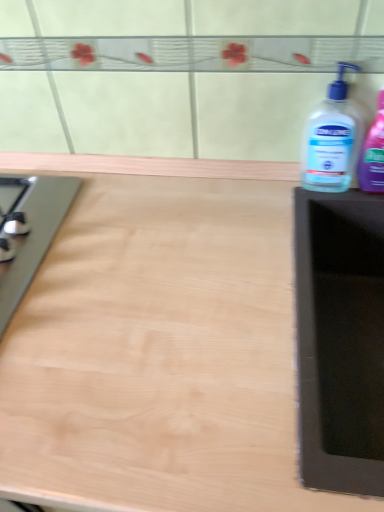
Question: Considering the positions of point (336, 184) and point (289, 423), is point (336, 184) closer or farther from the camera than point (289, 423)?

Choices:
 (A) closer
 (B) farther

Answer: (B)

Question: Relative to light wood countertop at center, is transparent plastic bottle at right, the first bottle when ordered from left to right, in front or behind?

Choices:
 (A) behind
 (B) front

Answer: (A)

Question: Which of these objects is positioned farthest from the transparent plastic bottle at right, which appears as the 2th bottle when viewed from the right?

Choices:
 (A) transparent plastic bottle at right, arranged as the 2th bottle when viewed from the left
 (B) light wood countertop at center

Answer: (B)

Question: Which object is the closest to the light wood countertop at center?

Choices:
 (A) transparent plastic bottle at right, arranged as the 2th bottle when viewed from the left
 (B) transparent plastic bottle at right, the first bottle when ordered from left to right

Answer: (B)